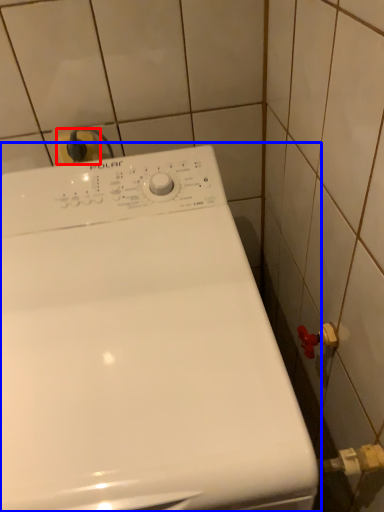
Question: Which object appears closest to the camera in this image, electric outlet (highlighted by a red box) or washing machine (highlighted by a blue box)?

Choices:
 (A) electric outlet
 (B) washing machine

Answer: (B)